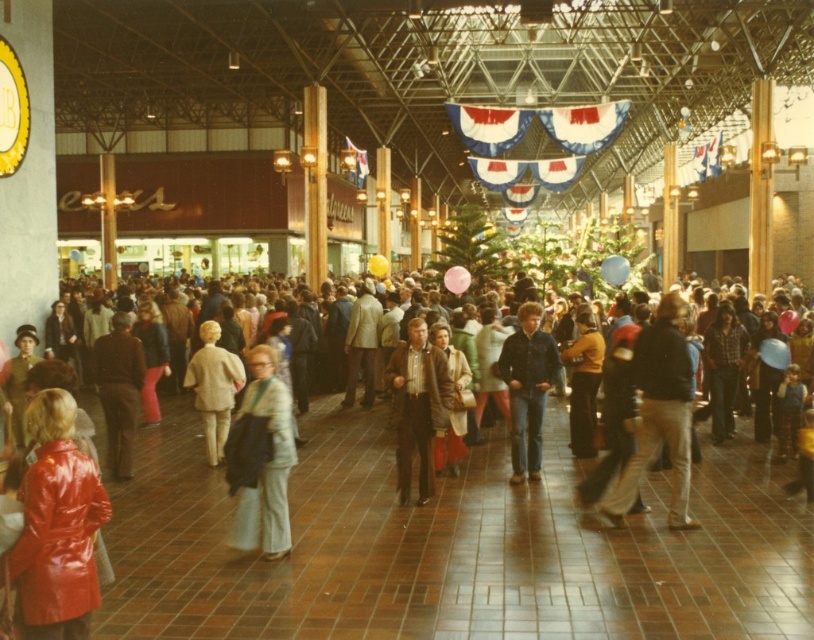
You are a store manager checking inventory and notice two items displayed in the mall. The shiny red coat at lower left and the denim jacket at center. Which item is shorter in height?

The shiny red coat at lower left has a lesser height compared to the denim jacket at center, so the shiny red coat at lower left is shorter in height.

You are a customer in this mall and want to pick up both the shiny red coat at lower left and the denim jacket at center. Since you can only carry one item at a time, you need to know which item is closer to the entrance. If the entrance is located at the opposite end of the mall from where you are standing, which item should you pick first to minimize walking distance?

The shiny red coat at lower left is closer to the entrance than the denim jacket at center. Since the entrance is at the opposite end, you should pick up the shiny red coat at lower left first to minimize walking distance.